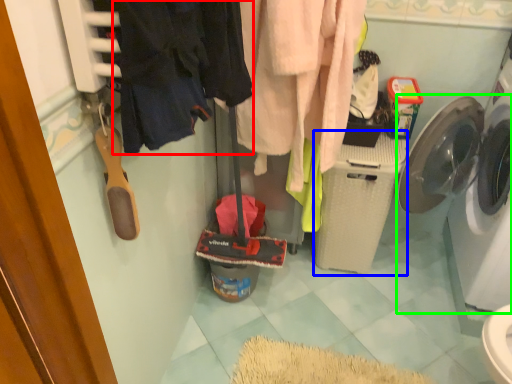
Question: Estimate the real-world distances between objects in this image. Which object is closer to clothing (highlighted by a red box), washing machine (highlighted by a blue box) or washing machine (highlighted by a green box)?

Choices:
 (A) washing machine
 (B) washing machine

Answer: (A)